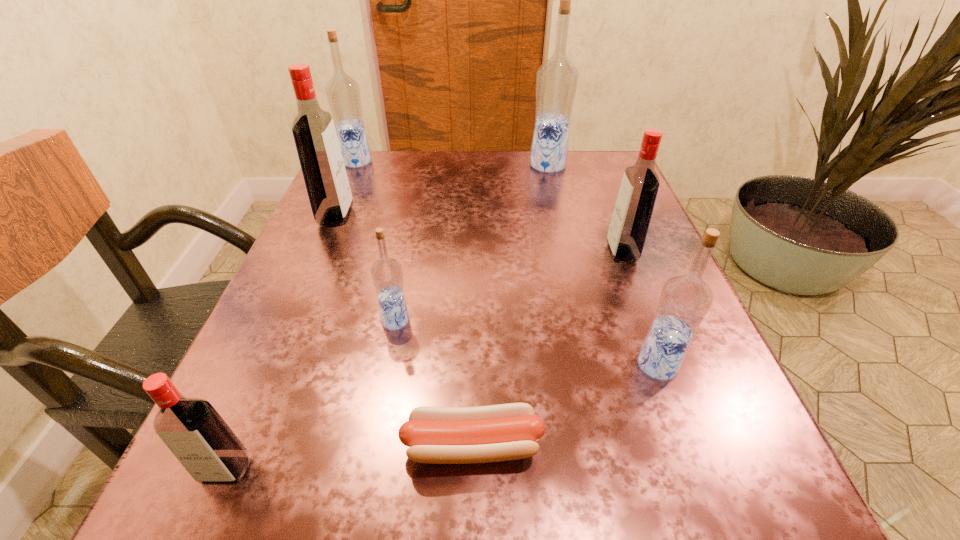
At what (x,y) coordinates should I click in order to perform the action: click on free space located on the front and back of the second nearest red vodka. Please return your answer as a coordinate pair (x, y). Image resolution: width=960 pixels, height=540 pixels. Looking at the image, I should click on pyautogui.click(x=523, y=253).

Locate an element on the screen. vacant space located on the back of the rightmost blue vodka is located at coordinates (636, 306).

This screenshot has width=960, height=540. Find the location of `vacant space located on the right of the fifth farthest object`. vacant space located on the right of the fifth farthest object is located at coordinates (516, 321).

In order to click on vacant position located on the back of the fifth object from left to right in this screenshot , I will do `click(475, 253)`.

Where is `vodka positioned at the near edge`? vodka positioned at the near edge is located at coordinates (192, 429).

The height and width of the screenshot is (540, 960). I want to click on sausage that is at the near edge, so click(x=437, y=435).

I want to click on object located in the far left corner section of the desktop, so coord(343,93).

Locate an element on the screen. Image resolution: width=960 pixels, height=540 pixels. object that is at the near left corner is located at coordinates (192, 429).

Where is `object present at the far right corner`? The image size is (960, 540). object present at the far right corner is located at coordinates (556, 82).

Image resolution: width=960 pixels, height=540 pixels. I want to click on vacant area at the far edge, so 523,151.